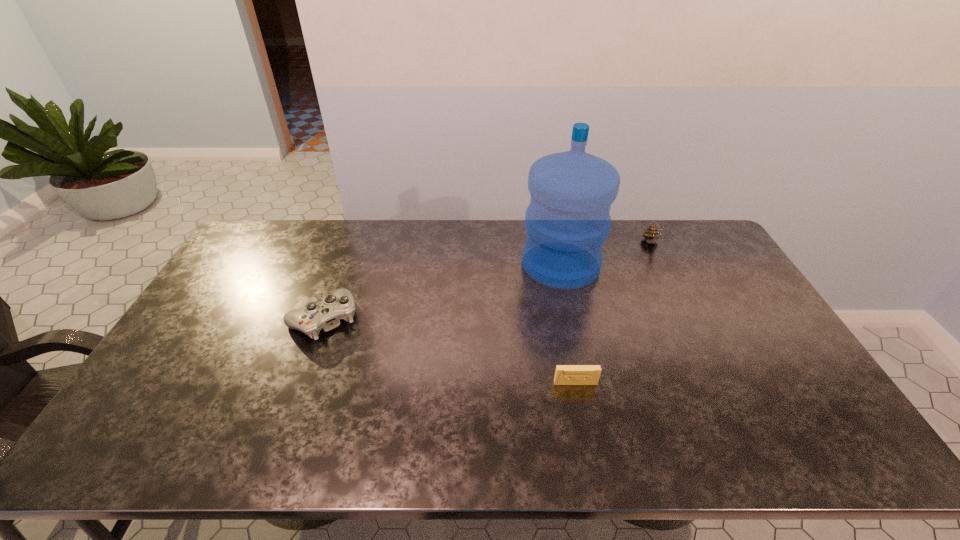
Where is `vacant space located at the front of the videotape with spools`? The image size is (960, 540). vacant space located at the front of the videotape with spools is located at coordinates (581, 410).

Identify the location of water jug positioned at the far edge. (567, 221).

At what (x,y) coordinates should I click in order to perform the action: click on snail that is at the far edge. Please return your answer as a coordinate pair (x, y). This screenshot has height=540, width=960. Looking at the image, I should click on (652, 235).

In the image, there is a desktop. At what (x,y) coordinates should I click in order to perform the action: click on free space at the far edge. Please return your answer as a coordinate pair (x, y). The image size is (960, 540). Looking at the image, I should click on (372, 251).

The image size is (960, 540). Identify the location of free space at the near edge. (199, 427).

Image resolution: width=960 pixels, height=540 pixels. Identify the location of vacant space at the left edge. (194, 314).

Image resolution: width=960 pixels, height=540 pixels. In the image, there is a desktop. Identify the location of vacant space at the right edge. (761, 388).

Image resolution: width=960 pixels, height=540 pixels. In the image, there is a desktop. Find the location of `blank space at the far left corner`. blank space at the far left corner is located at coordinates click(x=281, y=256).

Locate an element on the screen. free space at the near right corner is located at coordinates pyautogui.click(x=795, y=434).

Where is `empty location between the rightmost object and the tallest object`? empty location between the rightmost object and the tallest object is located at coordinates (607, 254).